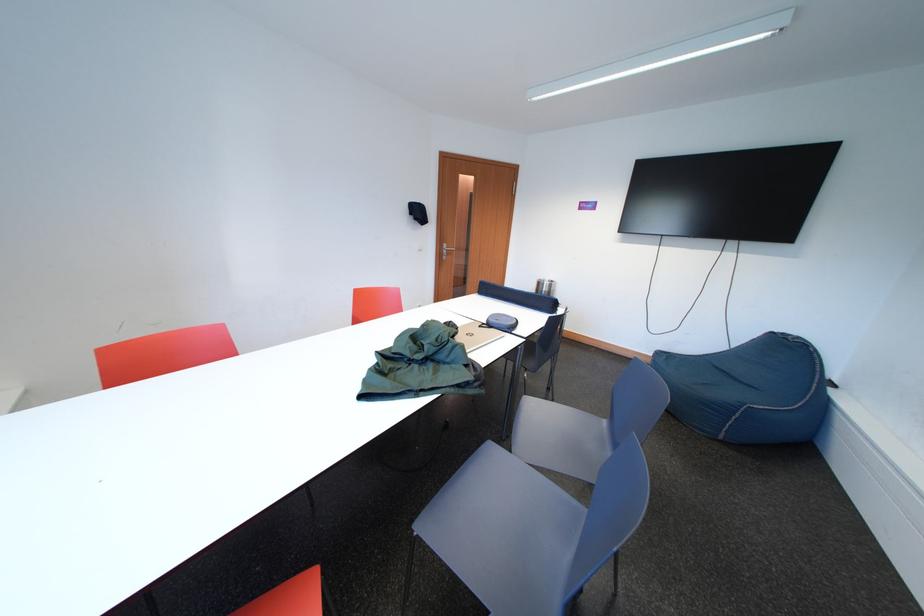
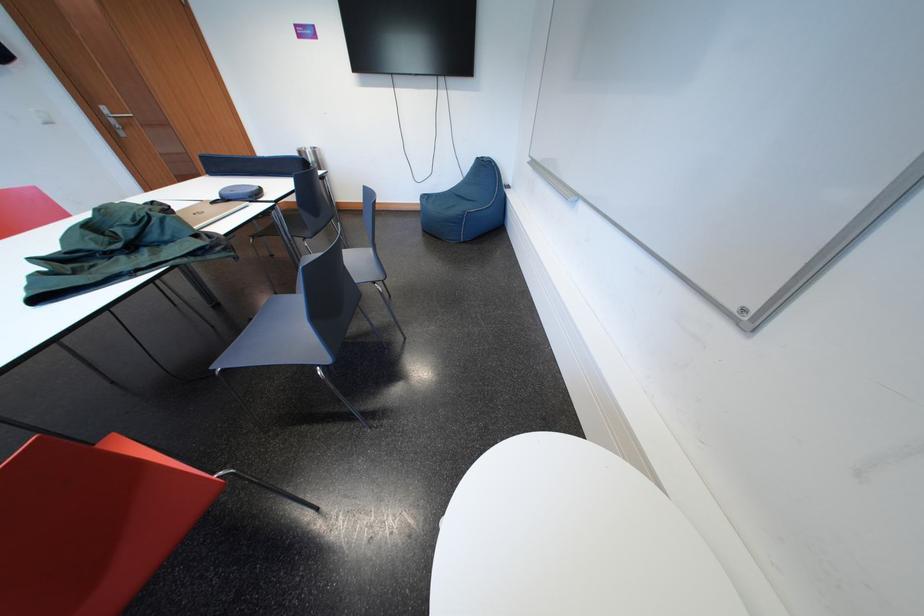
Locate, in the second image, the point that corresponds to (x=499, y=330) in the first image.

(235, 204)